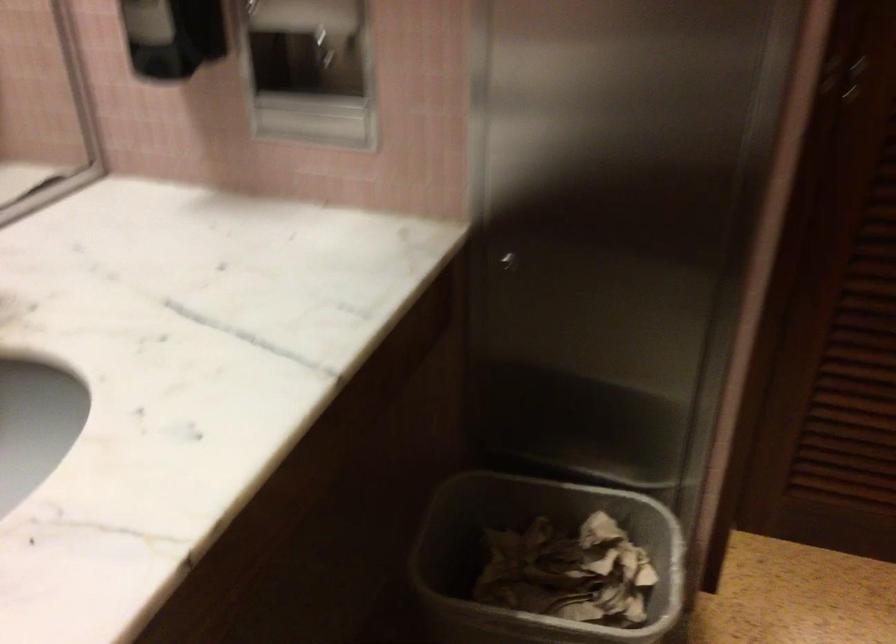
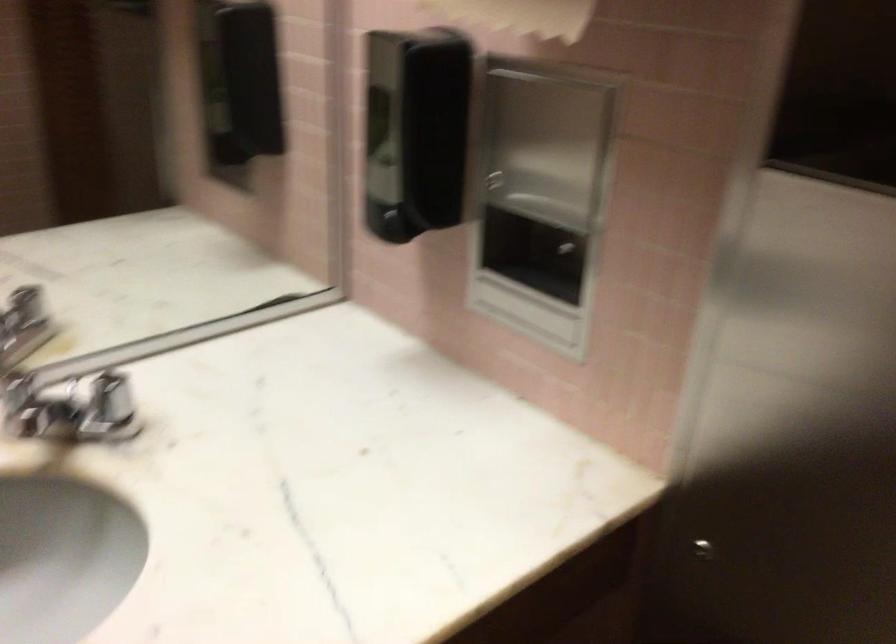
Question: Based on the continuous images, in which direction is the camera rotating? Reply with the corresponding letter.

Choices:
 (A) Left
 (B) Right
 (C) Up
 (D) Down

Answer: (A)